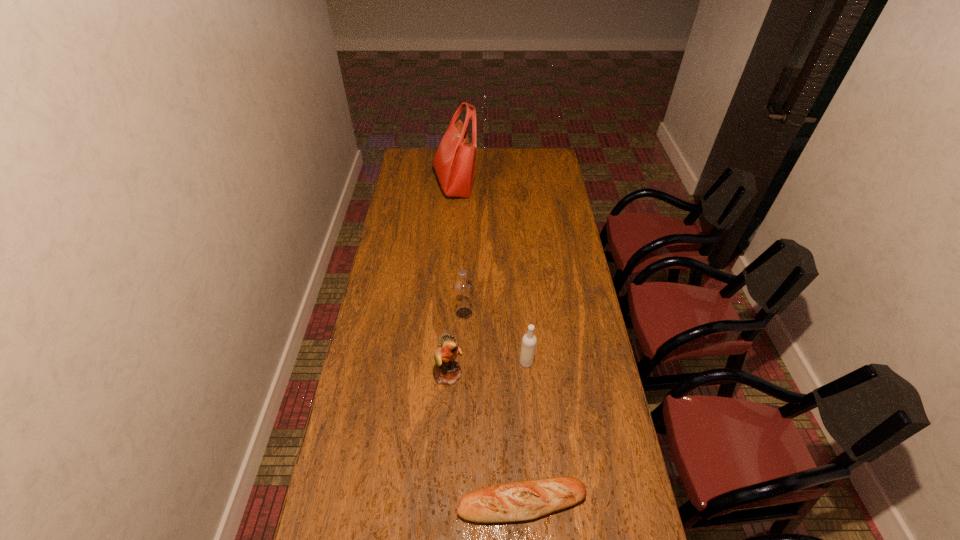
Image resolution: width=960 pixels, height=540 pixels. What are the coordinates of `empty space between the second farthest object and the nearest object` in the screenshot? It's located at (493, 408).

In order to click on unoccupied position between the left vodka and the right vodka in this screenshot , I will do `click(495, 338)`.

Identify the location of free space between the left vodka and the shortest object. This screenshot has width=960, height=540. (493, 408).

I want to click on free space between the right vodka and the baguet, so (524, 433).

At what (x,y) coordinates should I click in order to perform the action: click on free space between the baguet and the tallest object. Please return your answer as a coordinate pair (x, y). This screenshot has height=540, width=960. Looking at the image, I should click on (489, 343).

The height and width of the screenshot is (540, 960). What are the coordinates of `empty space between the fourth nearest object and the handbag` in the screenshot? It's located at (459, 249).

This screenshot has width=960, height=540. What are the coordinates of `free space that is in between the right vodka and the shortest object` in the screenshot? It's located at (524, 433).

This screenshot has height=540, width=960. In order to click on vacant region between the farthest object and the shortest object in this screenshot , I will do `click(489, 343)`.

The height and width of the screenshot is (540, 960). Find the location of `the third closest object relative to the left vodka`. the third closest object relative to the left vodka is located at coordinates (523, 500).

Find the location of a particular element. object that is the third closest to the farther vodka is located at coordinates coord(523,500).